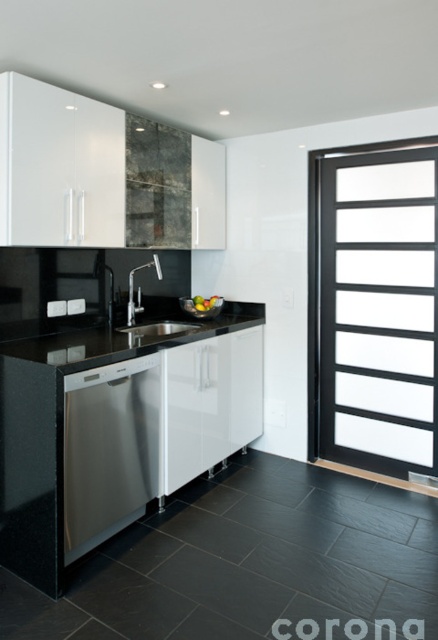
You are a delivery person who just arrived at the kitchen to install a new dishwasher. The new dishwasher requires a minimum of 2 meters of space in front of it to be safely installed. Based on the scene, can the stainless steel dishwasher at lower left be replaced with the new one?

The stainless steel dishwasher at lower left is 2.29 meters from the camera, which is more than the required 2 meters. Therefore, the new dishwasher can be safely installed in its place.

You are a kitchen designer planning to install a new appliance. You need to place a new microwave above the stainless steel dishwasher at lower left. Is there enough vertical space between the dishwasher and the black granite countertop at center to fit the microwave?

The stainless steel dishwasher at lower left is below the black granite countertop at center, so there is vertical space between them. However, the exact height required for the microwave isn not provided, so it depends on the microwave size. If the microwave is shorter than the distance between the dishwasher and the countertop, it should fit.

You are a kitchen designer and need to install a new appliance that requires a minimum of 30 inches of space between it and the sink. You have the stainless steel dishwasher at lower left and the black stainless steel sink at center in the scene. Can the dishwasher be placed at its current position relative to the sink?

The distance between the stainless steel dishwasher at lower left and the black stainless steel sink at center is 32.53 inches, which exceeds the minimum requirement of 30 inches. Therefore, the dishwasher can be placed at its current position relative to the sink.